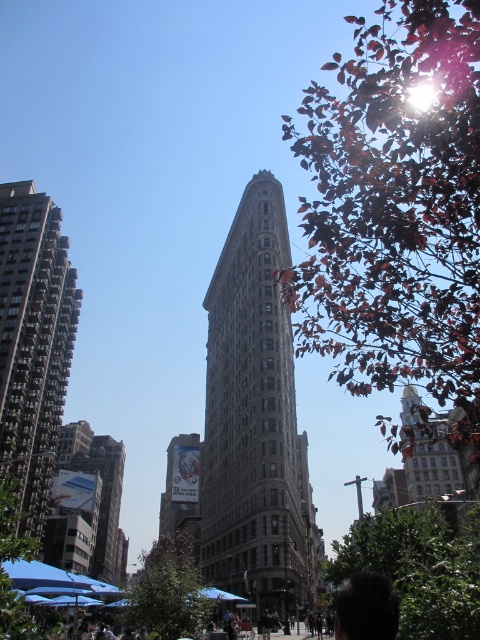
Between dark gray concrete building at left and green leafy tree at lower left, which one has less height?

green leafy tree at lower left

Is dark gray concrete building at left smaller than green leafy tree at lower left?

No, dark gray concrete building at left is not smaller than green leafy tree at lower left.

I want to click on dark gray concrete building at left, so (x=33, y=342).

Which of these two, green leafy tree at lower center or green leafy tree at lower left, stands shorter?

green leafy tree at lower left

Looking at this image, between green leafy tree at lower center and green leafy tree at lower left, which one appears on the right side from the viewer's perspective?

From the viewer's perspective, green leafy tree at lower center appears more on the right side.

This screenshot has width=480, height=640. I want to click on green leafy tree at lower center, so click(168, 592).

Is green leafy tree at upper right wider than brown stone building at center?

Indeed, green leafy tree at upper right has a greater width compared to brown stone building at center.

Can you confirm if green leafy tree at upper right is smaller than brown stone building at center?

Actually, green leafy tree at upper right might be larger than brown stone building at center.

From the picture: Who is more forward, (x=466, y=24) or (x=264, y=461)?

Positioned in front is point (x=466, y=24).

Find the location of a particular element. This screenshot has height=640, width=480. green leafy tree at upper right is located at coordinates (396, 209).